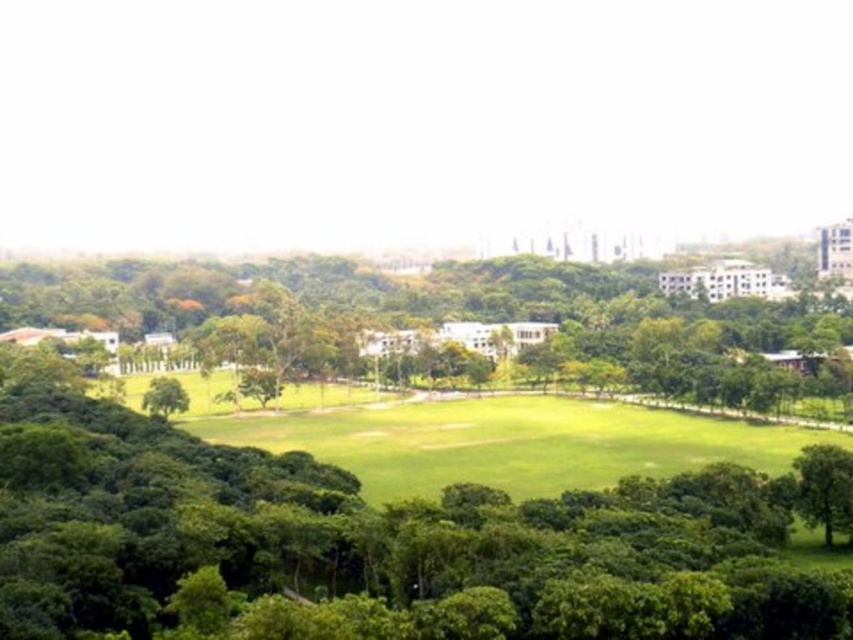
Question: Can you confirm if green leafy tree at lower right is positioned to the left of green leafy tree at lower left?

Choices:
 (A) yes
 (B) no

Answer: (B)

Question: Which of the following is the farthest from the observer?

Choices:
 (A) green leafy tree at center
 (B) green leafy tree at lower left
 (C) green grassy field at center

Answer: (A)

Question: Which point is closer to the camera?

Choices:
 (A) green leafy tree at center
 (B) green leafy tree at lower left
 (C) green leafy tree at lower right
 (D) green grassy field at center

Answer: (C)

Question: Based on their relative distances, which object is nearer to the green leafy tree at lower left?

Choices:
 (A) green leafy tree at center
 (B) green grassy field at center

Answer: (B)

Question: Is green grassy field at center thinner than green leafy tree at lower right?

Choices:
 (A) yes
 (B) no

Answer: (B)

Question: Is green leafy tree at center bigger than green leafy tree at lower left?

Choices:
 (A) yes
 (B) no

Answer: (A)